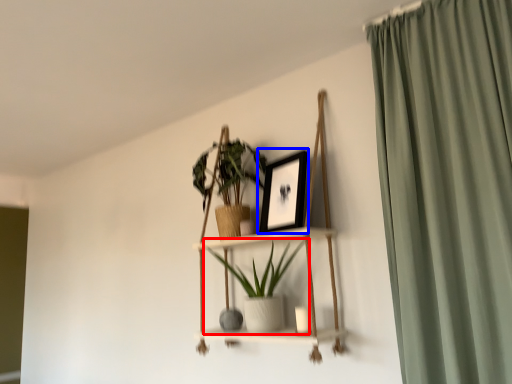
Question: Which object appears closest to the camera in this image, houseplant (highlighted by a red box) or picture frame (highlighted by a blue box)?

Choices:
 (A) houseplant
 (B) picture frame

Answer: (A)